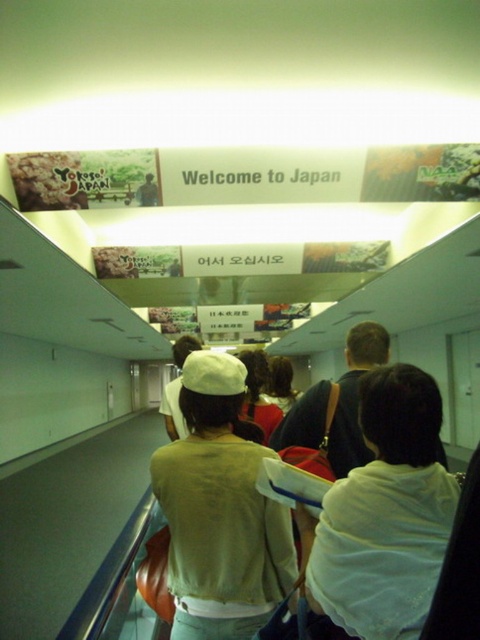
You are an airport staff member checking clothing sizes for a lost and found. You see a white fabric shirt at center and a light beige sweater at center. Which clothing item is smaller in size?

The white fabric shirt at center is smaller in size compared to the light beige sweater at center.

You are standing at the bottom of the escalator in the airport scene. You see two people in front of you wearing a white fabric shirt at center and a light beige sweater at center. Which person is positioned to the right?

The white fabric shirt at center is to the right of the light beige sweater at center.